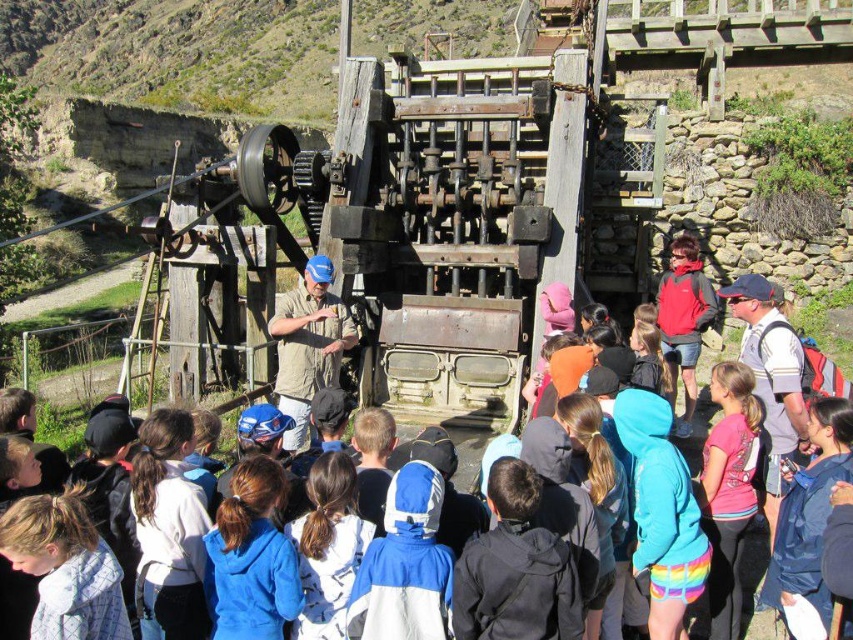
You are a maintenance worker standing 1.5 meters away from the blue fleece jacket at lower center. You need to reach the white fabric at center to secure it. Can you reach it without moving closer?

The blue fleece jacket at lower center is 1.47 meters away from the white fabric at center. Since you are already 1.5 meters away from the blue fleece jacket at lower center, the total distance to the white fabric at center would be approximately 2.97 meters. This distance is likely too far to reach without moving closer, so you cannot secure the white fabric at center from your current position.

You are a photographer trying to capture the group of people around the stamp mill. You notice the pink fabric shirt at center and the white fabric at center. Which one would appear bigger in your photo if you focus on the center?

The pink fabric shirt at center would appear bigger in the photo because it is larger in size than the white fabric at center.

You are standing at the origin point in the image. Which of the two points, point (x=753, y=458) or point (x=321, y=608), is farther away from you?

Point (x=753, y=458) is farther away from you because it is behind point (x=321, y=608).